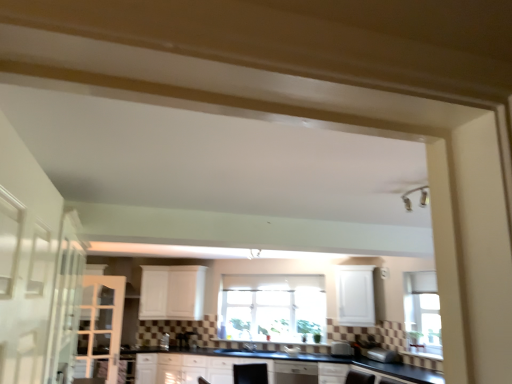
Question: Is clear glass window at center outside of satin silver toaster at lower center, which appears as the 1th appliance when viewed from the right?

Choices:
 (A) yes
 (B) no

Answer: (A)

Question: From the image's perspective, would you say clear glass window at center is shown under satin silver toaster at lower center, which is counted as the second appliance, starting from the left?

Choices:
 (A) yes
 (B) no

Answer: (B)

Question: From a real-world perspective, is clear glass window at center on satin silver toaster at lower center, the 2th appliance positioned from the back?

Choices:
 (A) no
 (B) yes

Answer: (B)

Question: Considering the relative sizes of clear glass window at center and satin silver toaster at lower center, the 1th appliance when ordered from front to back, in the image provided, is clear glass window at center thinner than satin silver toaster at lower center, the 1th appliance when ordered from front to back,?

Choices:
 (A) no
 (B) yes

Answer: (B)

Question: Can you confirm if clear glass window at center is positioned to the right of satin silver toaster at lower center, which appears as the 1th appliance when viewed from the right?

Choices:
 (A) no
 (B) yes

Answer: (A)

Question: Looking at the image, does clear glass window at center seem bigger or smaller compared to white glass screen door at left?

Choices:
 (A) small
 (B) big

Answer: (B)

Question: From their relative heights in the image, would you say clear glass window at center is taller or shorter than white glass screen door at left?

Choices:
 (A) tall
 (B) short

Answer: (B)

Question: Choose the correct answer: Is clear glass window at center inside white glass screen door at left or outside it?

Choices:
 (A) outside
 (B) inside

Answer: (A)

Question: Would you say clear glass window at center is to the left or to the right of white glass screen door at left in the picture?

Choices:
 (A) right
 (B) left

Answer: (A)

Question: Is black glossy sink at center wider or thinner than white glass screen door at left?

Choices:
 (A) thin
 (B) wide

Answer: (B)

Question: Considering the positions of point 219,347 and point 110,311, is point 219,347 closer or farther from the camera than point 110,311?

Choices:
 (A) closer
 (B) farther

Answer: (B)

Question: Is black glossy sink at center inside or outside of white glass screen door at left?

Choices:
 (A) outside
 (B) inside

Answer: (A)

Question: Considering the positions of black glossy sink at center and white glass screen door at left in the image, is black glossy sink at center bigger or smaller than white glass screen door at left?

Choices:
 (A) small
 (B) big

Answer: (B)

Question: Is white glass screen door at left bigger or smaller than satin silver toaster at lower center, arranged as the second appliance when viewed from the front?

Choices:
 (A) big
 (B) small

Answer: (A)

Question: In the image, is white glass screen door at left on the left side or the right side of satin silver toaster at lower center, the first appliance in the back-to-front sequence?

Choices:
 (A) right
 (B) left

Answer: (B)